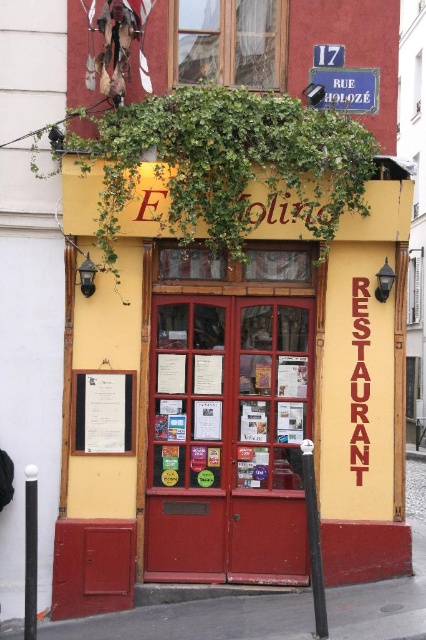
Question: Among these objects, which one is nearest to the camera?

Choices:
 (A) white paper menu at center
 (B) green leafy ivy at upper center

Answer: (B)

Question: Is green leafy ivy at upper center below white paper menu at center?

Choices:
 (A) yes
 (B) no

Answer: (B)

Question: Is green leafy ivy at upper center wider than white paper menu at center?

Choices:
 (A) yes
 (B) no

Answer: (A)

Question: Does green leafy ivy at upper center lie behind white paper menu at center?

Choices:
 (A) no
 (B) yes

Answer: (A)

Question: Which of the following is the farthest from the observer?

Choices:
 (A) (273, 97)
 (B) (123, 451)

Answer: (B)

Question: Among these points, which one is farthest from the camera?

Choices:
 (A) (236, 93)
 (B) (129, 401)

Answer: (B)